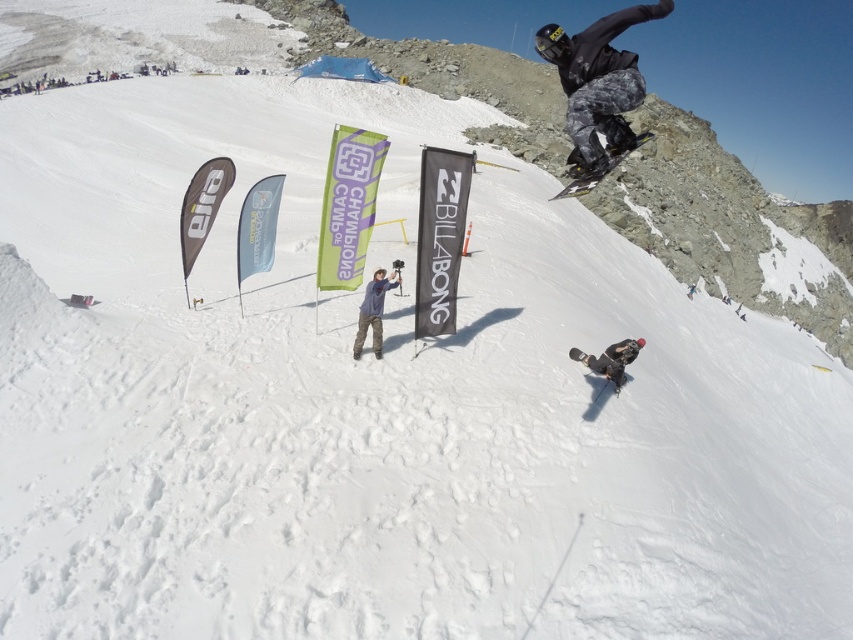
Question: Can you confirm if camouflage pants at upper right is positioned above dark gray snowboarder at lower right?

Choices:
 (A) yes
 (B) no

Answer: (A)

Question: Does camouflage pants at upper right have a lesser width compared to shiny black snowboard at upper right?

Choices:
 (A) yes
 (B) no

Answer: (A)

Question: Which of the following is the farthest from the observer?

Choices:
 (A) camouflage pants at upper right
 (B) black matte snowboard at lower center
 (C) denim pants at center

Answer: (B)

Question: Which of these objects is positioned closest to the dark gray snowboarder at lower right?

Choices:
 (A) denim pants at center
 (B) camouflage pants at upper right
 (C) black matte snowboard at lower center

Answer: (C)

Question: Can you confirm if denim pants at center is smaller than dark gray snowboarder at lower right?

Choices:
 (A) yes
 (B) no

Answer: (A)

Question: Which object is positioned closest to the camouflage pants at upper right?

Choices:
 (A) black matte snowboard at lower center
 (B) denim pants at center
 (C) shiny black snowboard at upper right

Answer: (C)